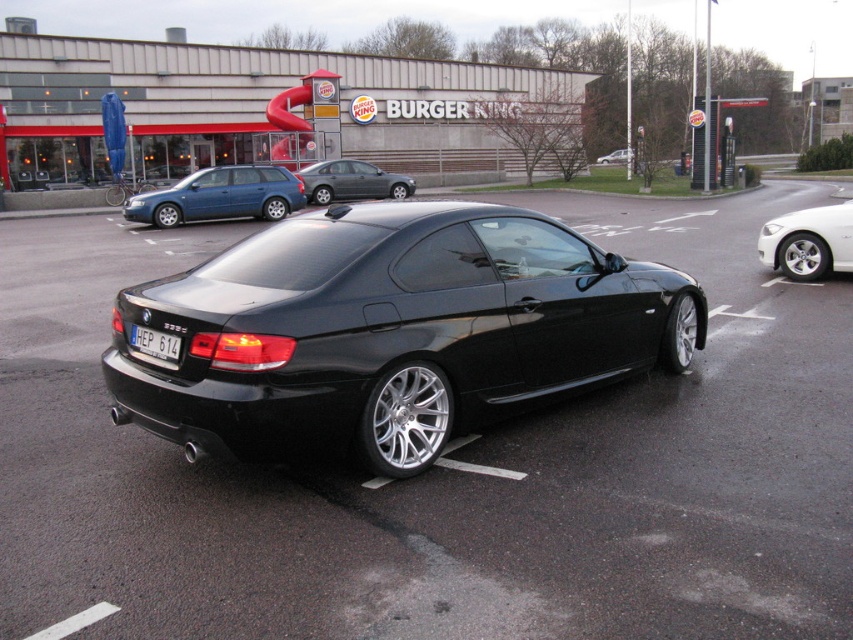
Can you confirm if matte blue station wagon at left is positioned to the left of matte black car at center?

Indeed, matte blue station wagon at left is positioned on the left side of matte black car at center.

Does matte blue station wagon at left have a lesser height compared to matte black car at center?

Correct, matte blue station wagon at left is not as tall as matte black car at center.

Identify the location of matte blue station wagon at left. The height and width of the screenshot is (640, 853). coord(219,196).

Is black metallic sports car at center to the right of metallic gray sedan at center from the viewer's perspective?

Correct, you'll find black metallic sports car at center to the right of metallic gray sedan at center.

Does point (236, 387) come closer to viewer compared to point (405, 186)?

That is True.

At what (x,y) coordinates should I click in order to perform the action: click on black metallic sports car at center. Please return your answer as a coordinate pair (x, y). The image size is (853, 640). Looking at the image, I should click on (390, 328).

The width and height of the screenshot is (853, 640). What do you see at coordinates (445, 468) in the screenshot?
I see `black metallic car at center` at bounding box center [445, 468].

Is black metallic car at center further to camera compared to black metallic sports car at center?

No, black metallic car at center is closer to the viewer.

Identify the location of black metallic car at center. (445, 468).